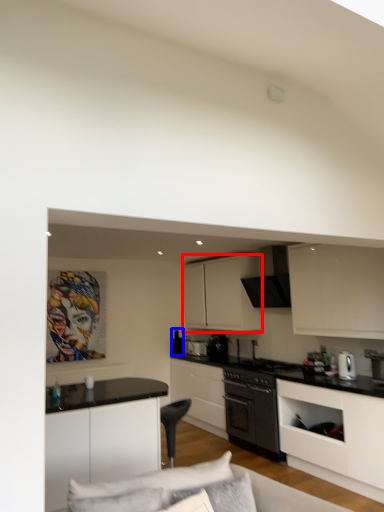
Question: Which point is further to the camera, cabinetry (highlighted by a red box) or appliance (highlighted by a blue box)?

Choices:
 (A) cabinetry
 (B) appliance

Answer: (B)